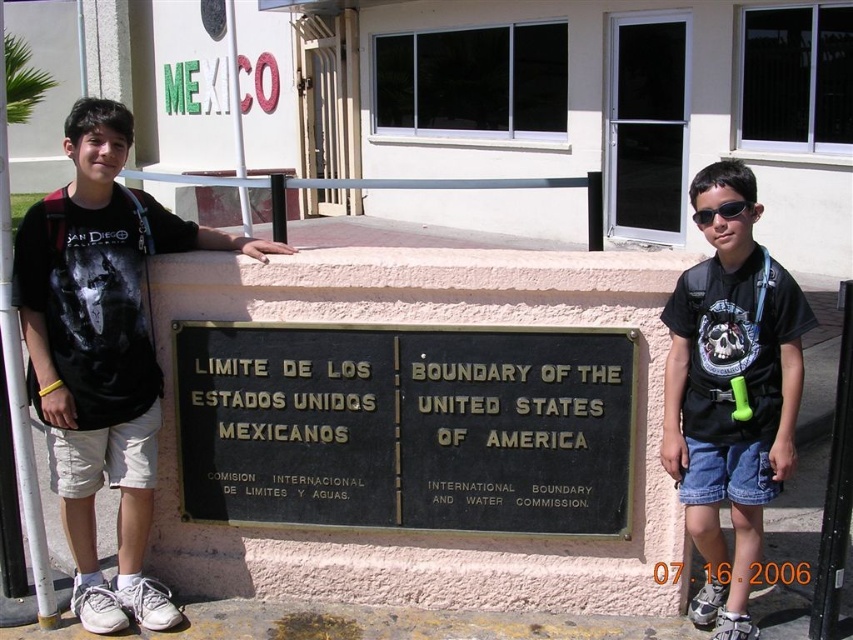
Who is more distant from viewer, (622, 524) or (692, 284)?

A: Positioned behind is point (622, 524).

Identify the location of black polished metal plaque at center. This screenshot has height=640, width=853. (405, 426).

This screenshot has width=853, height=640. I want to click on black polished metal plaque at center, so click(x=405, y=426).

Is black polished metal plaque at center to the left of black plastic sunglasses at center from the viewer's perspective?

Correct, you'll find black polished metal plaque at center to the left of black plastic sunglasses at center.

Does point (392, 504) lie in front of point (746, 208)?

No, (392, 504) is behind (746, 208).

This screenshot has height=640, width=853. I want to click on black polished metal plaque at center, so pos(405,426).

Identify the location of black matte t-shirt at left. (102, 353).

Does black matte t-shirt at left appear over matte black t-shirt at center?

Correct, black matte t-shirt at left is located above matte black t-shirt at center.

Image resolution: width=853 pixels, height=640 pixels. Describe the element at coordinates (102, 353) in the screenshot. I see `black matte t-shirt at left` at that location.

Where is `black matte t-shirt at left`? The height and width of the screenshot is (640, 853). black matte t-shirt at left is located at coordinates (102, 353).